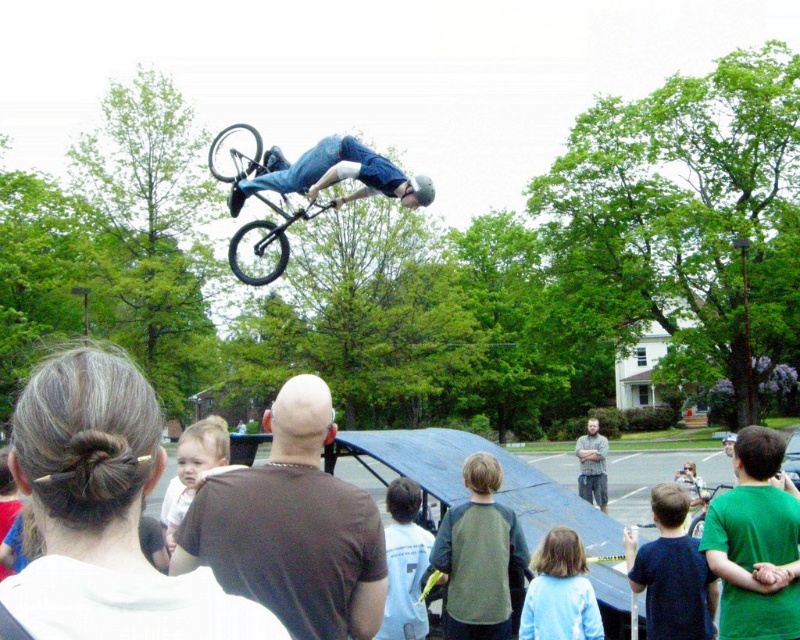
Based on the coordinates provided, which object is located at point [672,572]?

The dark blue shirt at lower right is located at point [672,572].

You are a photographer at the event and want to capture both the dark blue shirt at lower right and the light pink fabric baby at center in a single photo. Which object should you focus on first to ensure both are in frame?

You should focus on the light pink fabric baby at center first because it is larger in size compared to the dark blue shirt at lower right, ensuring it fits within the frame while adjusting for the smaller object.

You are a photographer trying to capture the perfect shot of the bicycle stunt. You notice two points in the scene labeled as point [418,504] and point [700,497]. Which point should you focus on to ensure it appears larger in your photo?

Point [418,504] should be focused on because it is closer to the camera than point [700,497], making it appear larger in the photo.